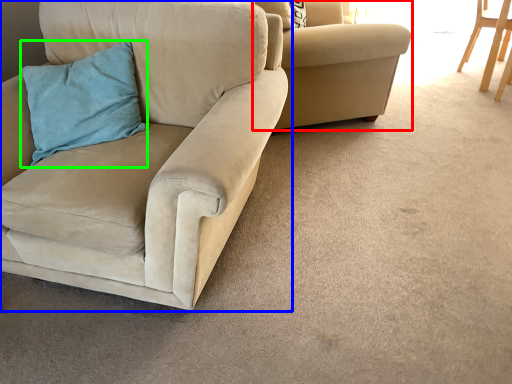
Question: Based on their relative distances, which object is nearer to chair (highlighted by a red box)? Choose from chair (highlighted by a blue box) and pillow (highlighted by a green box).

Choices:
 (A) chair
 (B) pillow

Answer: (A)